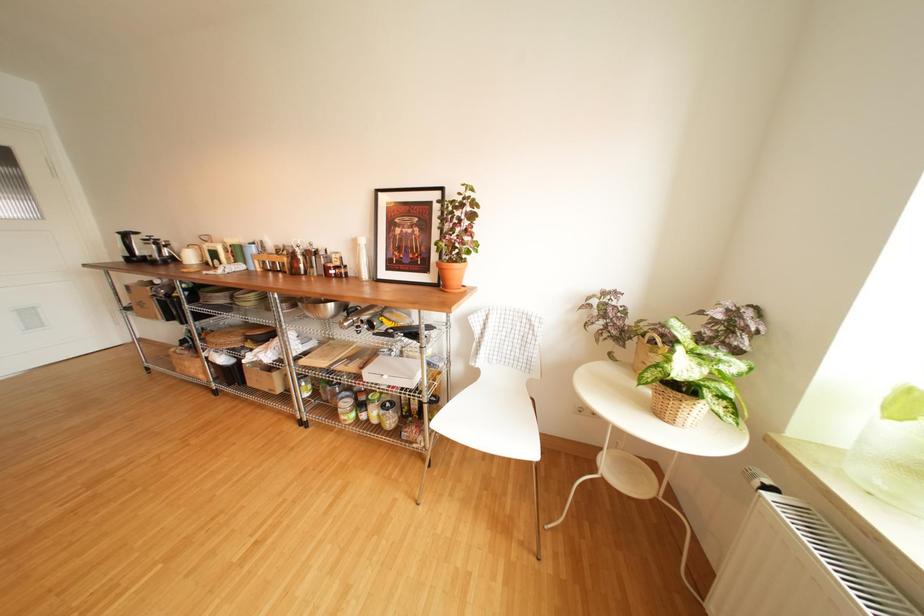
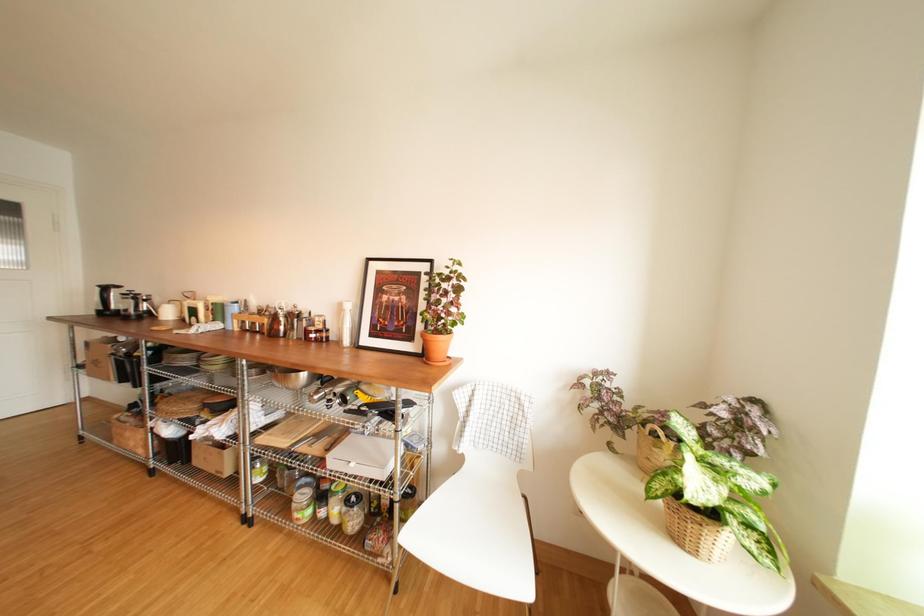
Question: Based on the continuous images, in which direction is the camera rotating? Reply with the corresponding letter.

Choices:
 (A) Left
 (B) Right
 (C) Up
 (D) Down

Answer: (C)